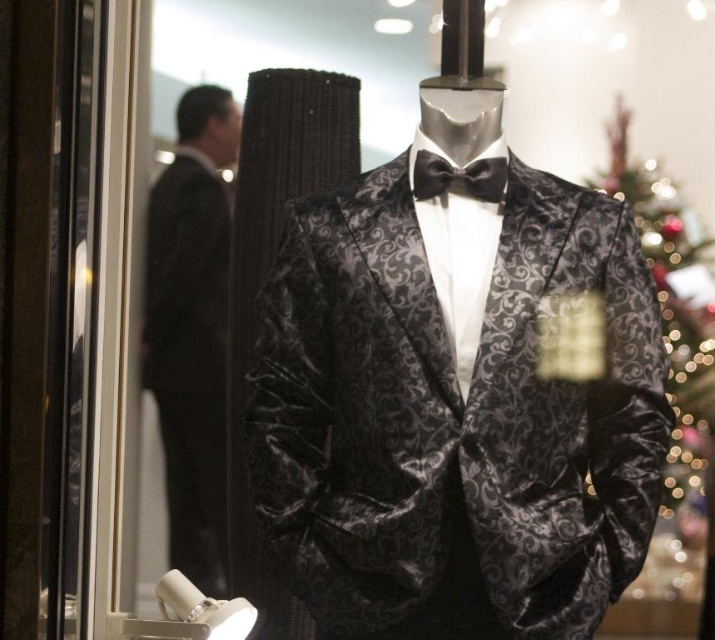
Is black velvet suit at left to the left of black satin bow tie at center from the viewer's perspective?

Correct, you'll find black velvet suit at left to the left of black satin bow tie at center.

Between black velvet suit at left and black satin bow tie at center, which one is positioned higher?

black satin bow tie at center

Is point (187, 122) closer to camera compared to point (495, 196)?

No, it is not.

Identify the location of black velvet suit at left. The width and height of the screenshot is (715, 640). (192, 330).

How distant is velvet/black suit at center from black satin bow tie at center?

The distance of velvet/black suit at center from black satin bow tie at center is 12.03 inches.

Is velvet/black suit at center shorter than black satin bow tie at center?

Incorrect, velvet/black suit at center's height does not fall short of black satin bow tie at center's.

Who is more distant from viewer, (393, 572) or (485, 164)?

Point (485, 164)

Where is `velvet/black suit at center`? The width and height of the screenshot is (715, 640). velvet/black suit at center is located at coordinates (453, 408).

How distant is velvet/black suit at center from black velvet suit at left?

velvet/black suit at center is 12.34 inches away from black velvet suit at left.

Which is behind, point (281, 406) or point (167, 230)?

Positioned behind is point (167, 230).

Identify the location of velvet/black suit at center. The width and height of the screenshot is (715, 640). (453, 408).